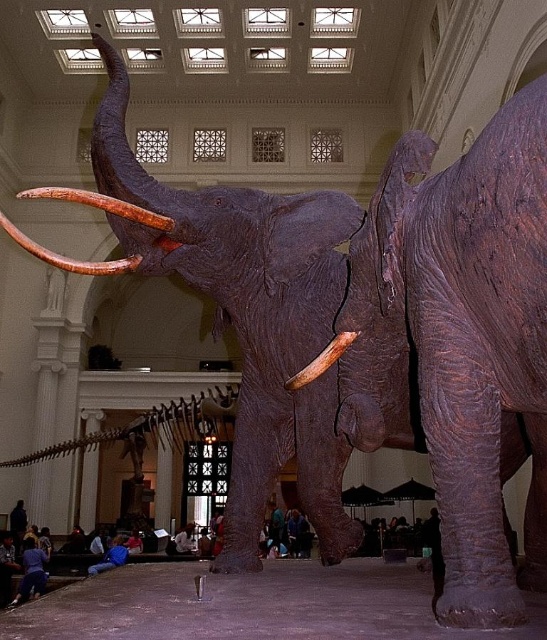
Between blue jeans at lower left and blue jeans at center, which one has more height?

With more height is blue jeans at center.

Between blue jeans at lower left and blue jeans at center, which one appears on the left side from the viewer's perspective?

Positioned to the left is blue jeans at lower left.

Is point (37, 572) farther from viewer compared to point (191, 550)?

No, it is in front of (191, 550).

In order to click on blue jeans at lower left in this screenshot , I will do `click(31, 572)`.

Between blue jeans at lower left and blue fabric shirt at lower center, which one appears on the right side from the viewer's perspective?

Positioned to the right is blue fabric shirt at lower center.

Is blue jeans at lower left positioned in front of blue fabric shirt at lower center?

Yes, blue jeans at lower left is in front of blue fabric shirt at lower center.

Which is behind, point (37, 592) or point (139, 545)?

Positioned behind is point (139, 545).

Identify the location of blue jeans at lower left. (31, 572).

Between point (92, 572) and point (129, 541), which one is positioned behind?

Positioned behind is point (129, 541).

Is the position of blue fabric pants at lower center more distant than that of blue fabric shirt at lower center?

That is False.

The width and height of the screenshot is (547, 640). Describe the element at coordinates (110, 556) in the screenshot. I see `blue fabric pants at lower center` at that location.

This screenshot has height=640, width=547. I want to click on blue fabric pants at lower center, so click(110, 556).